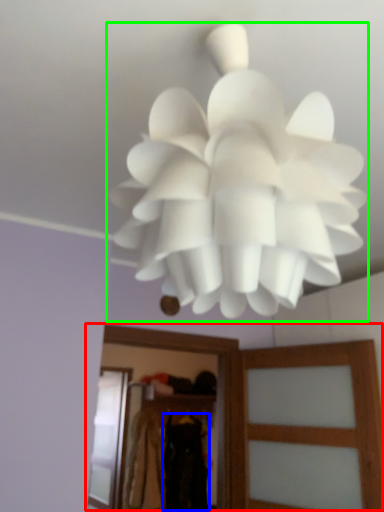
Question: Which object is the farthest from clothing (highlighted by a red box)? Choose among these: clothing (highlighted by a blue box) or lamp (highlighted by a green box).

Choices:
 (A) clothing
 (B) lamp

Answer: (A)